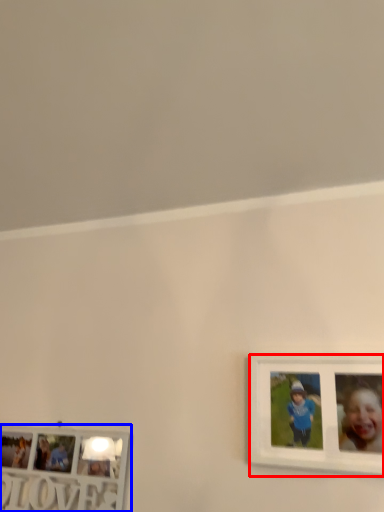
Question: Which of the following is the closest to the observer, picture frame (highlighted by a red box) or picture frame (highlighted by a blue box)?

Choices:
 (A) picture frame
 (B) picture frame

Answer: (A)